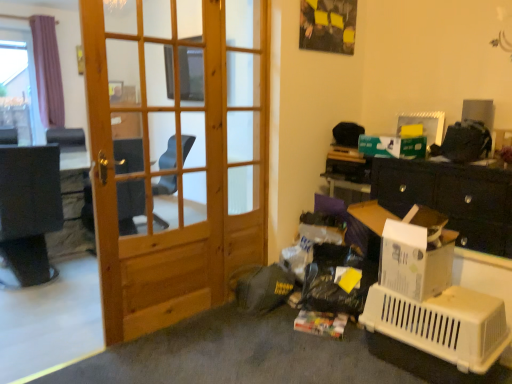
The width and height of the screenshot is (512, 384). What do you see at coordinates (429, 297) in the screenshot?
I see `white plastic pet carrier at lower right` at bounding box center [429, 297].

What do you see at coordinates (246, 136) in the screenshot? I see `wooden screen door at center` at bounding box center [246, 136].

The height and width of the screenshot is (384, 512). Find the location of `natural wood door at center`. natural wood door at center is located at coordinates (178, 152).

This screenshot has width=512, height=384. I want to click on white plastic pet carrier at lower right, so click(429, 297).

From the image's perspective, is wooden screen door at center positioned above or below natural wood door at center?

wooden screen door at center is above natural wood door at center.

Considering the positions of objects wooden screen door at center and natural wood door at center in the image provided, who is more to the right, wooden screen door at center or natural wood door at center?

wooden screen door at center is more to the right.

Is wooden screen door at center outside of natural wood door at center?

Indeed, wooden screen door at center is completely outside natural wood door at center.

In terms of size, does wooden screen door at center appear bigger or smaller than natural wood door at center?

Considering their sizes, wooden screen door at center takes up less space than natural wood door at center.

Is white plastic pet carrier at lower right next to wooden screen door at center and touching it?

No.

Is white plastic pet carrier at lower right inside or outside of wooden screen door at center?

white plastic pet carrier at lower right is outside wooden screen door at center.

Does white plastic pet carrier at lower right have a greater height compared to wooden screen door at center?

In fact, white plastic pet carrier at lower right may be shorter than wooden screen door at center.

Is white plastic pet carrier at lower right further to the viewer compared to wooden screen door at center?

No, white plastic pet carrier at lower right is closer to the viewer.

Can we say wooden screen door at center lies outside white plastic pet carrier at lower right?

That's correct, wooden screen door at center is outside of white plastic pet carrier at lower right.

From a real-world perspective, is wooden screen door at center physically above white plastic pet carrier at lower right?

Yes, from a real-world perspective, wooden screen door at center is on top of white plastic pet carrier at lower right.

Is the position of wooden screen door at center less distant than that of white plastic pet carrier at lower right?

That is False.

From the picture: In terms of height, does wooden screen door at center look taller or shorter compared to white plastic pet carrier at lower right?

Considering their sizes, wooden screen door at center has more height than white plastic pet carrier at lower right.

Which is farther, (x=158, y=136) or (x=237, y=68)?

The point (x=237, y=68) is farther from the camera.

Is natural wood door at center in front of or behind wooden screen door at center in the image?

Visually, natural wood door at center is located in front of wooden screen door at center.

Is wooden screen door at center at the back of natural wood door at center?

No.

In the scene shown: In terms of height, does natural wood door at center look taller or shorter compared to wooden screen door at center?

Clearly, natural wood door at center is shorter compared to wooden screen door at center.

Can you confirm if white plastic pet carrier at lower right is bigger than natural wood door at center?

No.

How different are the orientations of white plastic pet carrier at lower right and natural wood door at center in degrees?

The facing directions of white plastic pet carrier at lower right and natural wood door at center are 89.5 degrees apart.

Can natural wood door at center be found inside white plastic pet carrier at lower right?

No.

Can you confirm if white plastic pet carrier at lower right is wider than natural wood door at center?

Yes.

In the image, is natural wood door at center on the left side or the right side of white plastic pet carrier at lower right?

From the image, it's evident that natural wood door at center is to the left of white plastic pet carrier at lower right.

Which is in front, natural wood door at center or white plastic pet carrier at lower right?

white plastic pet carrier at lower right is in front.

From the image's perspective, is natural wood door at center located above or below white plastic pet carrier at lower right?

From the image's perspective, natural wood door at center appears above white plastic pet carrier at lower right.

How different are the orientations of natural wood door at center and white plastic pet carrier at lower right in degrees?

They differ by 89.5 degrees in their facing directions.

This screenshot has width=512, height=384. In order to click on door lying below the wooden screen door at center (from the image's perspective) in this screenshot , I will do `click(178, 152)`.

I want to click on desk that appears on the right of wooden screen door at center, so click(429, 297).

From the picture: Estimate the real-world distances between objects in this image. Which object is closer to white plastic pet carrier at lower right, natural wood door at center or wooden screen door at center?

Based on the image, wooden screen door at center appears to be nearer to white plastic pet carrier at lower right.

Based on their spatial positions, is wooden screen door at center or natural wood door at center further from white plastic pet carrier at lower right?

natural wood door at center is positioned further to the anchor white plastic pet carrier at lower right.

Based on their spatial positions, is wooden screen door at center or white plastic pet carrier at lower right closer to natural wood door at center?

The object closer to natural wood door at center is wooden screen door at center.

Estimate the real-world distances between objects in this image. Which object is further from wooden screen door at center, white plastic pet carrier at lower right or natural wood door at center?

Based on the image, white plastic pet carrier at lower right appears to be further to wooden screen door at center.

From the picture: Considering their positions, is natural wood door at center positioned further to wooden screen door at center than white plastic pet carrier at lower right?

Among the two, white plastic pet carrier at lower right is located further to wooden screen door at center.

Estimate the real-world distances between objects in this image. Which object is closer to natural wood door at center, white plastic pet carrier at lower right or wooden screen door at center?

wooden screen door at center.

Locate an element on the screen. screen door located between natural wood door at center and white plastic pet carrier at lower right in the left-right direction is located at coordinates (246, 136).